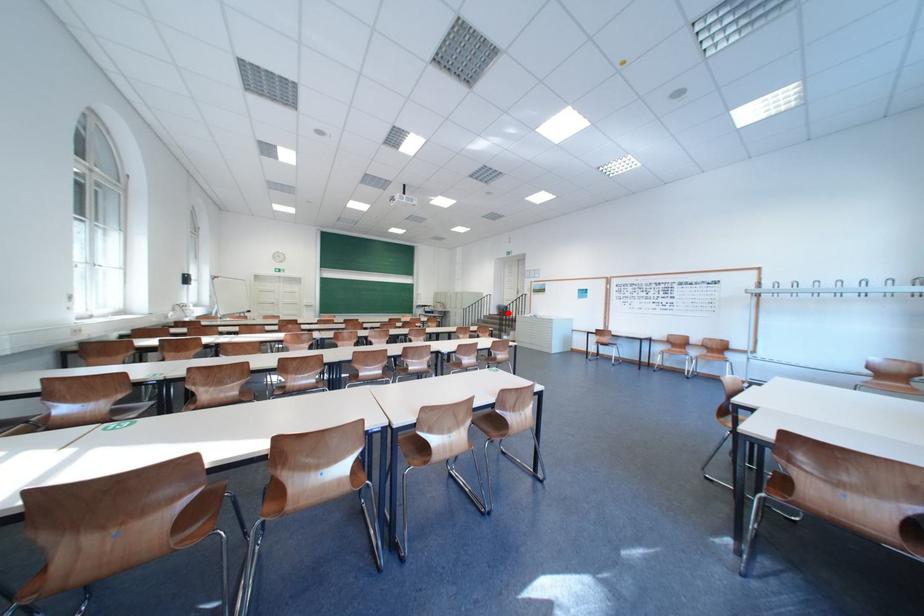
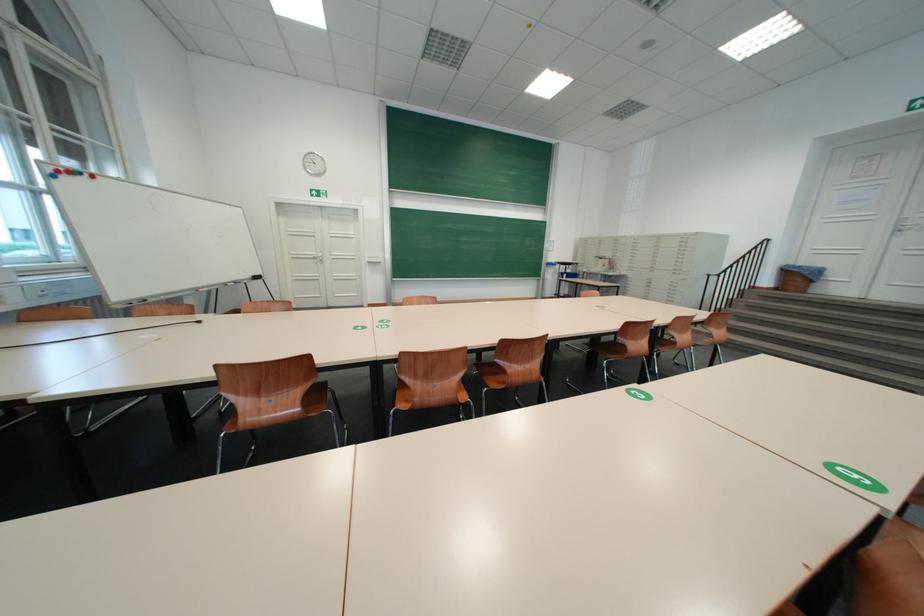
Where in the second image is the point corresponding to the highlighted location from the first image?

(781, 283)